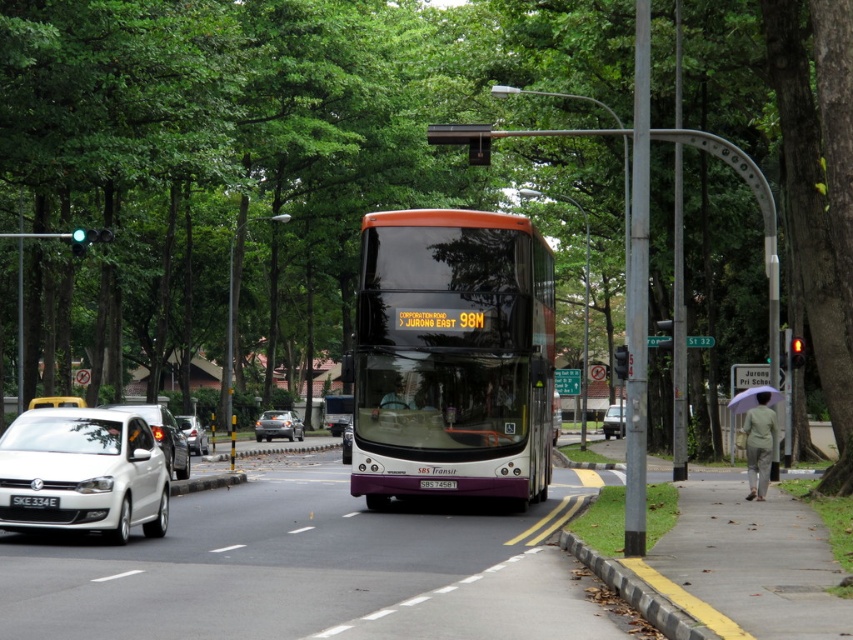
Consider the image. You are a pedestrian standing at the camera position looking at the street scene. There are two points marked on the image, point (283, 417) and point (428, 481). Which point is closer to you?

Point (283, 417) is further to the camera than point (428, 481), so the point closer to you is point (428, 481).

You are a pedestrian standing at the crosswalk near the shiny silver sedan at center and the black plastic license plate at center. The crosswalk is 160 feet long. Can you safely cross the road before the vehicles reach you?

The distance between the shiny silver sedan at center and the black plastic license plate at center is 160.13 feet, which is slightly longer than the crosswalk. Since the vehicles are stationary at the traffic light, you can safely cross the road before they move.

You are a delivery driver who needs to park your vehicle in the area shown. There is a shiny silver sedan at center. Can you park your car in the area marked by the point at coordinates [277,426]?

The point at coordinates [277,426] marks the location of a shiny silver sedan at center, so you cannot park there as it is occupied by the vehicle.